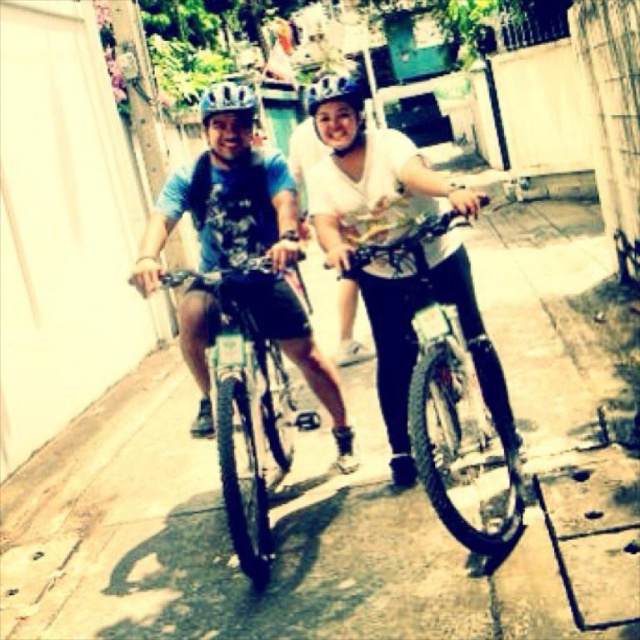
Question: Estimate the real-world distances between objects in this image. Which object is closer to the shiny metallic bicycle at center?

Choices:
 (A) smooth concrete pavement at center
 (B) matte blue shirt at center
 (C) matte black bicycle at center
 (D) matte black helmet at center

Answer: (C)

Question: Among these objects, which one is nearest to the camera?

Choices:
 (A) matte black helmet at center
 (B) shiny metallic bicycle at center
 (C) matte black bicycle at center
 (D) smooth concrete pavement at center

Answer: (B)

Question: Does matte blue shirt at center have a smaller size compared to matte blue helmet at center?

Choices:
 (A) yes
 (B) no

Answer: (A)

Question: Estimate the real-world distances between objects in this image. Which object is farther from the smooth concrete pavement at center?

Choices:
 (A) matte blue helmet at center
 (B) matte black bicycle at center

Answer: (A)

Question: In this image, where is shiny metallic bicycle at center located relative to matte black helmet at center?

Choices:
 (A) above
 (B) below

Answer: (B)

Question: Can you confirm if smooth concrete pavement at center is positioned below matte black bicycle at center?

Choices:
 (A) no
 (B) yes

Answer: (B)